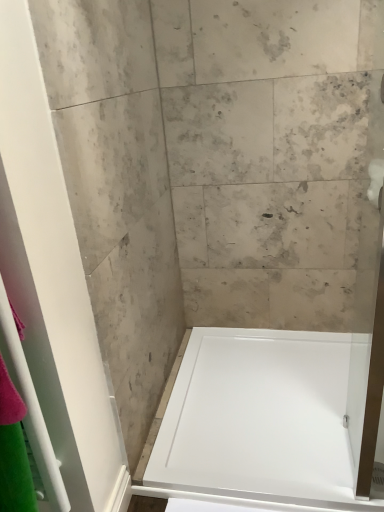
Question: Does white glossy shower door at left have a lesser width compared to white matte toilet paper at upper right?

Choices:
 (A) no
 (B) yes

Answer: (B)

Question: Is white glossy shower door at left next to white matte toilet paper at upper right and touching it?

Choices:
 (A) no
 (B) yes

Answer: (A)

Question: Does white glossy shower door at left have a greater width compared to white matte toilet paper at upper right?

Choices:
 (A) yes
 (B) no

Answer: (B)

Question: Is white matte toilet paper at upper right inside white glossy shower door at left?

Choices:
 (A) yes
 (B) no

Answer: (B)

Question: Can you confirm if white glossy shower door at left is bigger than white matte toilet paper at upper right?

Choices:
 (A) no
 (B) yes

Answer: (B)

Question: Considering the relative sizes of white glossy shower door at left and white matte toilet paper at upper right in the image provided, is white glossy shower door at left smaller than white matte toilet paper at upper right?

Choices:
 (A) no
 (B) yes

Answer: (A)

Question: From a real-world perspective, is white matte toilet paper at upper right over white glossy shower door at left?

Choices:
 (A) yes
 (B) no

Answer: (A)

Question: Is white matte toilet paper at upper right smaller than white glossy shower door at left?

Choices:
 (A) no
 (B) yes

Answer: (B)

Question: Is the depth of white matte toilet paper at upper right less than that of white glossy shower door at left?

Choices:
 (A) no
 (B) yes

Answer: (A)

Question: From the image's perspective, does white matte toilet paper at upper right appear lower than white glossy shower door at left?

Choices:
 (A) yes
 (B) no

Answer: (B)

Question: Considering the relative sizes of white matte toilet paper at upper right and white glossy shower door at left in the image provided, is white matte toilet paper at upper right shorter than white glossy shower door at left?

Choices:
 (A) yes
 (B) no

Answer: (A)

Question: Is white matte toilet paper at upper right not within white glossy shower door at left?

Choices:
 (A) yes
 (B) no

Answer: (A)

Question: Does white glossy bathtub at center lie behind white glossy shower door at left?

Choices:
 (A) no
 (B) yes

Answer: (B)